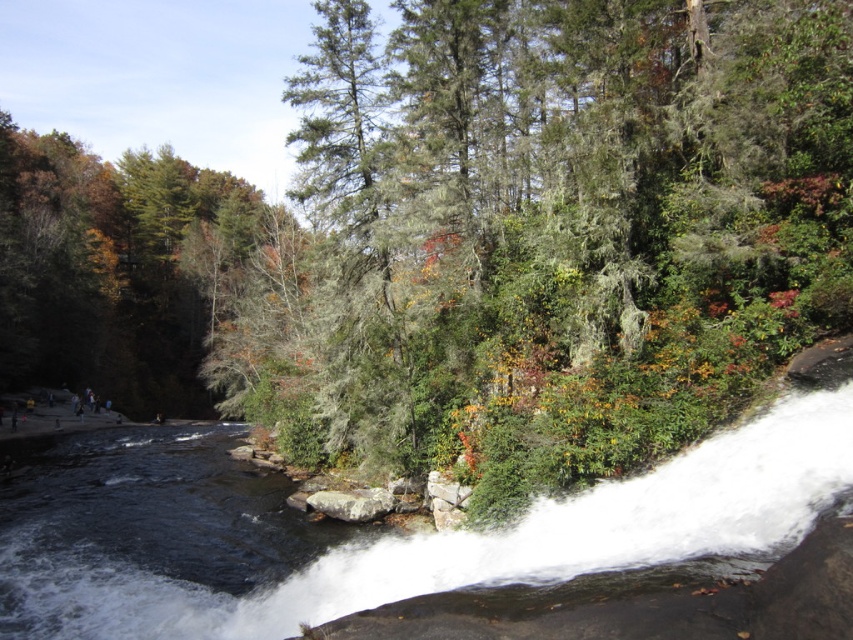
Consider the image. You are standing at the point marked by the coordinates point (373, 536) in the image. What type of water feature are you currently standing on?

You are standing on white frothy water at lower center, which is part of a small waterfall or cascade visible on the right side of the river.

You are standing at the edge of the river and see the white frothy water at lower center and the gray rough rock at center. Which object is nearer to you?

The white frothy water at lower center is closer to the viewer than the gray rough rock at center.